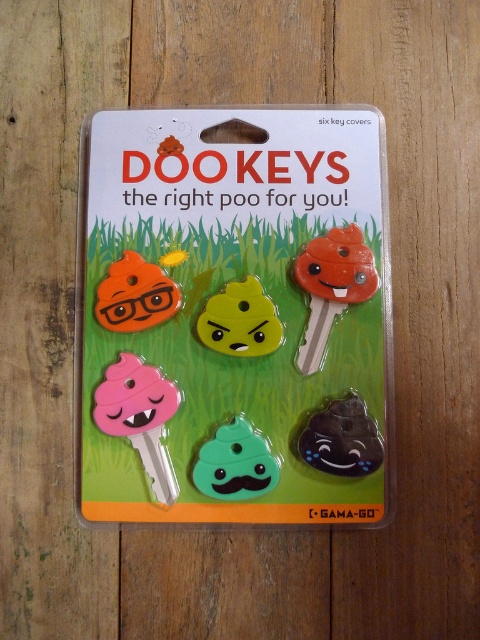
Question: Is orange matte key at center in front of yellow matte poop at center?

Choices:
 (A) no
 (B) yes

Answer: (B)

Question: Which point is closer to the camera taking this photo?

Choices:
 (A) (261, 452)
 (B) (319, 467)
 (C) (264, 336)
 (D) (109, 266)

Answer: (B)

Question: Which of the following is the farthest from the observer?

Choices:
 (A) (112, 381)
 (B) (370, 276)

Answer: (B)

Question: Can you confirm if orange matte key at center is thinner than green rubber poop at center?

Choices:
 (A) yes
 (B) no

Answer: (A)

Question: Estimate the real-world distances between objects in this image. Which object is closer to the orange matte poop at upper left?

Choices:
 (A) yellow matte poop at center
 (B) pink matte key at center
 (C) green rubber poop at center

Answer: (A)

Question: Is black rubber poop at center in front of yellow matte poop at center?

Choices:
 (A) yes
 (B) no

Answer: (A)